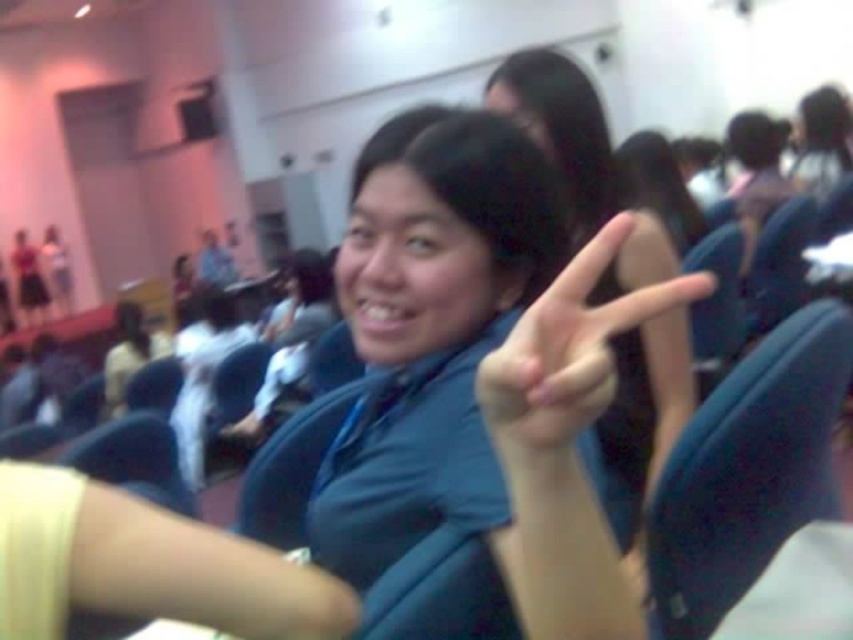
Question: Does blue fabric chair at right appear on the right side of matte blue shirt at center?

Choices:
 (A) yes
 (B) no

Answer: (A)

Question: Which point is closer to the camera?

Choices:
 (A) (596, 621)
 (B) (701, 484)

Answer: (A)

Question: Is blue fabric chair at right in front of matte blue shirt at center?

Choices:
 (A) no
 (B) yes

Answer: (A)

Question: Which point is closer to the camera?

Choices:
 (A) (614, 218)
 (B) (552, 470)

Answer: (B)

Question: Which of the following is the closest to the observer?

Choices:
 (A) (762, 468)
 (B) (526, 356)

Answer: (B)

Question: From the image, what is the correct spatial relationship of blue fabric chair at right in relation to matte blue shirt at center?

Choices:
 (A) left
 (B) right

Answer: (B)